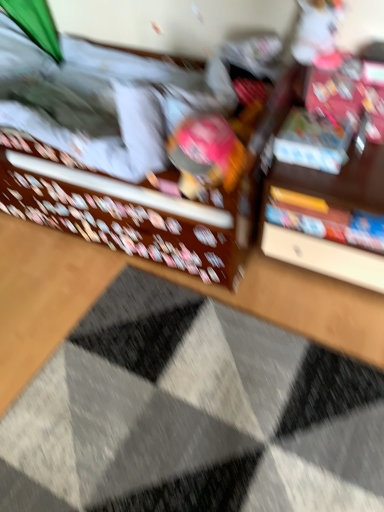
Question: Is textured gray doormat at center in front of or behind matte brown bed at center in the image?

Choices:
 (A) behind
 (B) front

Answer: (A)

Question: From a real-world perspective, is textured gray doormat at center physically located above or below matte brown bed at center?

Choices:
 (A) below
 (B) above

Answer: (A)

Question: Based on their relative distances, which object is nearer to the matte plastic book at upper right, which is the first book from top to bottom?

Choices:
 (A) matte plastic toy at center
 (B) hardcover book at center, the 1th book positioned from the bottom
 (C) textured gray doormat at center
 (D) matte brown bed at center

Answer: (B)

Question: Which of these objects is positioned farthest from the matte brown bed at center?

Choices:
 (A) textured gray doormat at center
 (B) hardcover book at center, the 1th book positioned from the bottom
 (C) matte plastic book at upper right, placed as the 2th book when sorted from bottom to top
 (D) matte plastic toy at center

Answer: (A)